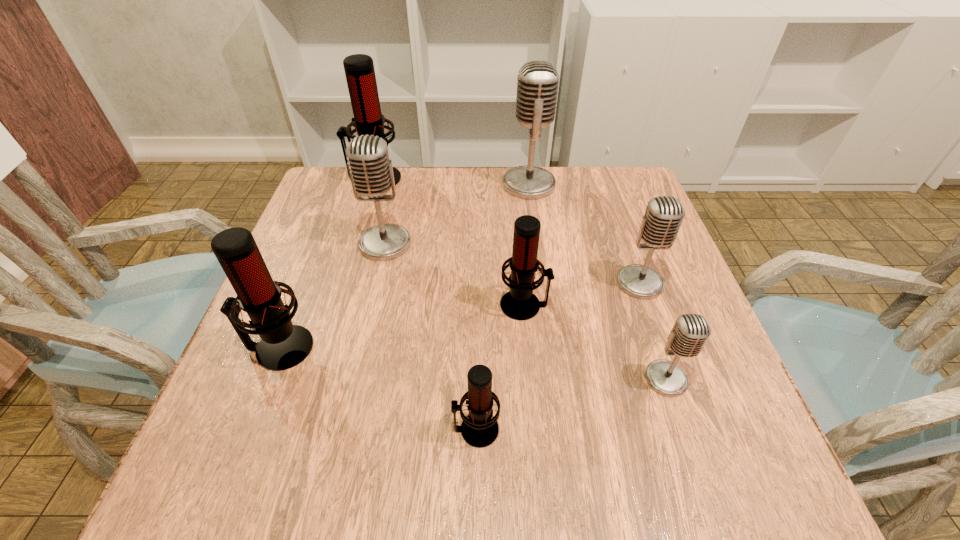
You are a GUI agent. You are given a task and a screenshot of the screen. Output one action in this format:
    pyautogui.click(x=<x>, y=<y>)
    Task: Click on the farthest red microphone
    This screenshot has height=540, width=960.
    Given the screenshot: What is the action you would take?
    pyautogui.click(x=359, y=70)

At what (x,y) coordinates should I click in order to perform the action: click on the farthest gray microphone. Please return your answer as a coordinate pair (x, y). The image size is (960, 540). Looking at the image, I should click on (537, 84).

You are a GUI agent. You are given a task and a screenshot of the screen. Output one action in this format:
    pyautogui.click(x=<x>, y=<y>)
    Task: Click on the biggest gray microphone
    This screenshot has width=960, height=540.
    Given the screenshot: What is the action you would take?
    point(537,84)

This screenshot has height=540, width=960. What are the coordinates of `the third farthest object` in the screenshot? It's located at (371, 173).

Where is `the second farthest gray microphone`? the second farthest gray microphone is located at coordinates (371, 173).

Find the location of a particular element. The image size is (960, 540). the second nearest red microphone is located at coordinates (284, 345).

The height and width of the screenshot is (540, 960). In order to click on the second nearest gray microphone in this screenshot , I will do `click(664, 214)`.

At what (x,y) coordinates should I click in order to perform the action: click on the third nearest red microphone. Please return your answer as a coordinate pair (x, y). Looking at the image, I should click on (520, 303).

The image size is (960, 540). Find the location of `the rightmost red microphone`. the rightmost red microphone is located at coordinates (520, 303).

Image resolution: width=960 pixels, height=540 pixels. In order to click on the nearest gray microphone in this screenshot , I will do `click(690, 332)`.